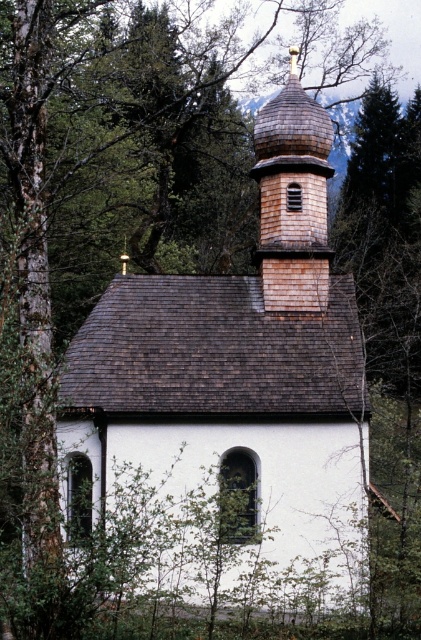
You are standing in front of the white wood church at center and looking towards the shiny brown shingles at upper center. Which object is closer to you?

The white wood church at center is closer to the viewer than the shiny brown shingles at upper center.